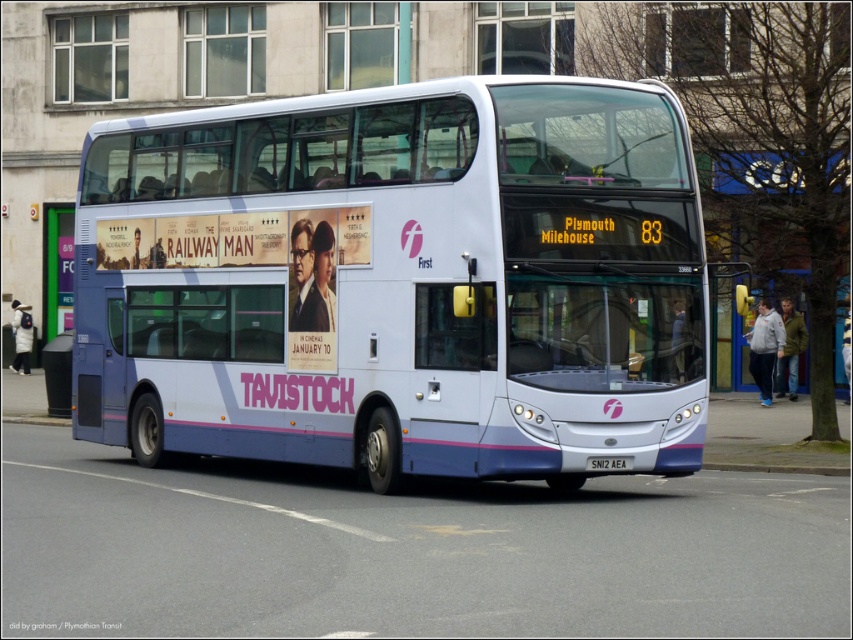
Is point (109, 275) closer to camera compared to point (611, 458)?

No, it is behind (611, 458).

Does white matte/decked bus at center appear on the left side of black plastic license plate at bottom center?

Indeed, white matte/decked bus at center is positioned on the left side of black plastic license plate at bottom center.

Locate an element on the screen. white matte/decked bus at center is located at coordinates (399, 280).